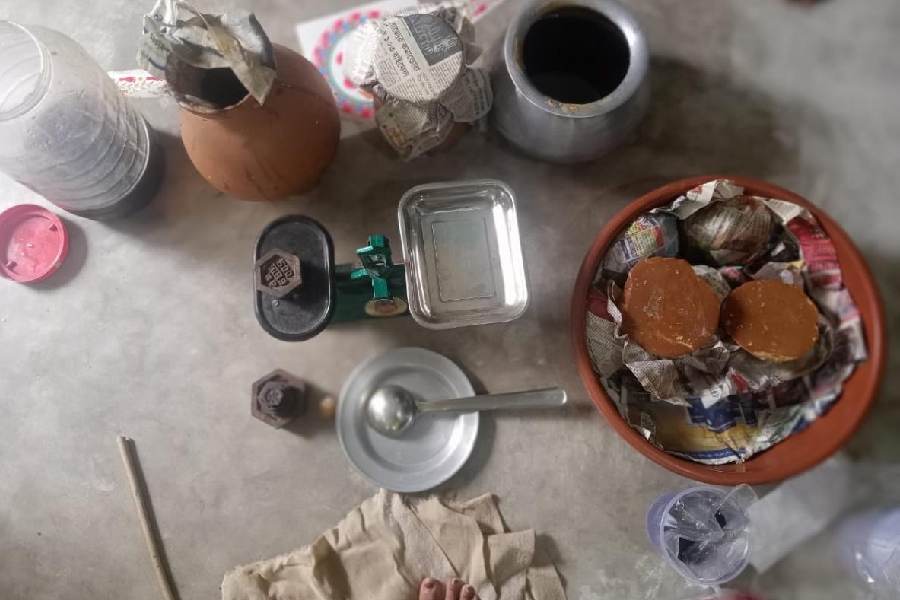
Image resolution: width=900 pixels, height=600 pixels. Find the location of `aluminium tray`. aluminium tray is located at coordinates (500, 243).